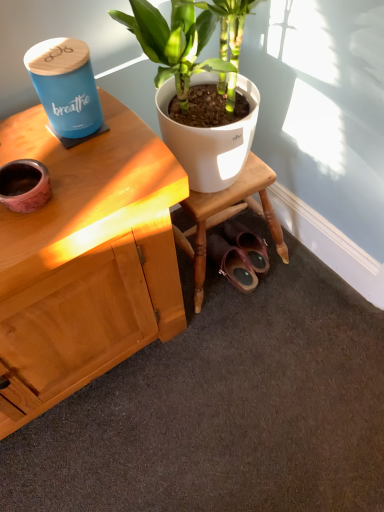
Identify the location of vacant space in front of leather/matte sandals at lower center. (242, 314).